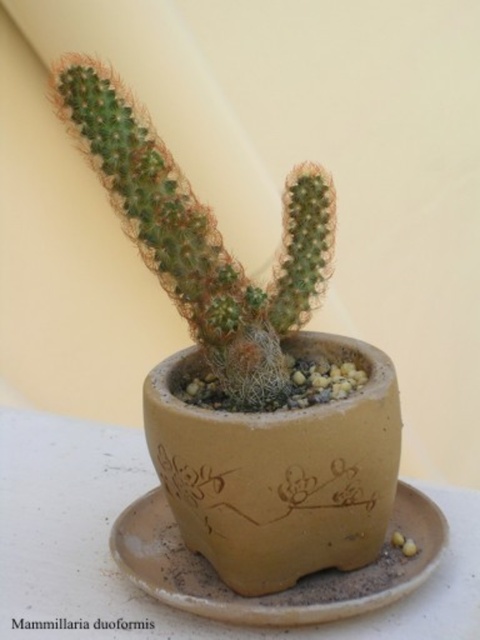
You are a gardener who wants to water the green matte mammillaria duoformis at center. The watering can is placed on the brown matte saucer at center. Which direction should you move the watering can to reach the cactus?

The brown matte saucer at center is positioned on the right side of the green matte mammillaria duoformis at center. Therefore, you should move the watering can from the right side toward the cactus to water it.

You are standing in front of the image and want to place a small decorative stone exactly where the green spiky cactus at center is currently positioned. According to the coordinates provided, where should you place the stone?

The green spiky cactus at center is located at point (202, 234), so you should place the decorative stone at those coordinates.

You are an interior designer arranging a shelf and see the green spiky cactus at center and the green matte mammillaria duoformis at center. Which one is closer to you?

The green spiky cactus at center is closer to the viewer than the green matte mammillaria duoformis at center.